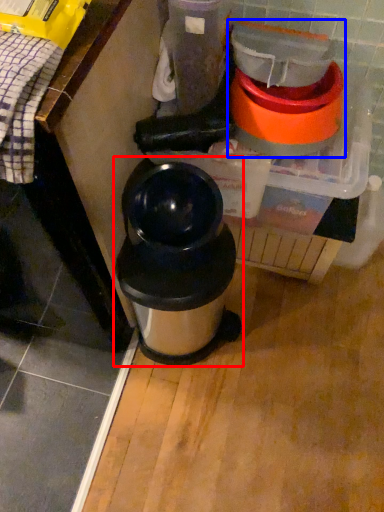
Question: Which object is further to the camera taking this photo, waste container (highlighted by a red box) or blender (highlighted by a blue box)?

Choices:
 (A) waste container
 (B) blender

Answer: (A)